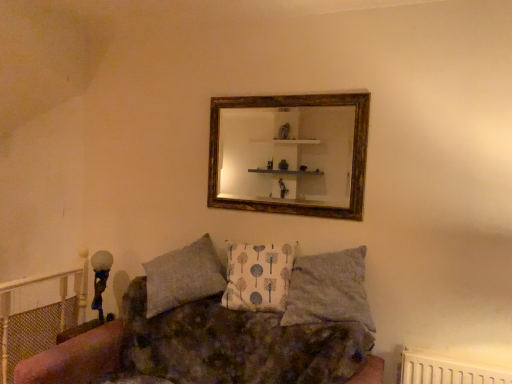
Question: Considering the positions of point (253, 289) and point (366, 311), is point (253, 289) closer or farther from the camera than point (366, 311)?

Choices:
 (A) farther
 (B) closer

Answer: (A)

Question: Considering the positions of white fabric pillow at center, the second pillow positioned from the right, and gray fabric pillow at center, which is the 1th pillow in right-to-left order, in the image, is white fabric pillow at center, the second pillow positioned from the right, bigger or smaller than gray fabric pillow at center, which is the 1th pillow in right-to-left order,?

Choices:
 (A) big
 (B) small

Answer: (B)

Question: Which of these objects is positioned closest to the textured fabric couch at center?

Choices:
 (A) gold-framed mirror at upper center
 (B) gray fabric pillow at center, which is the 1th pillow in right-to-left order
 (C) white fabric pillow at center, positioned as the 1th pillow in left-to-right order

Answer: (C)

Question: Which object is the farthest from the white fabric pillow at center, positioned as the 1th pillow in left-to-right order?

Choices:
 (A) gold-framed mirror at upper center
 (B) textured fabric couch at center
 (C) gray fabric pillow at center, which is the 1th pillow in right-to-left order

Answer: (A)